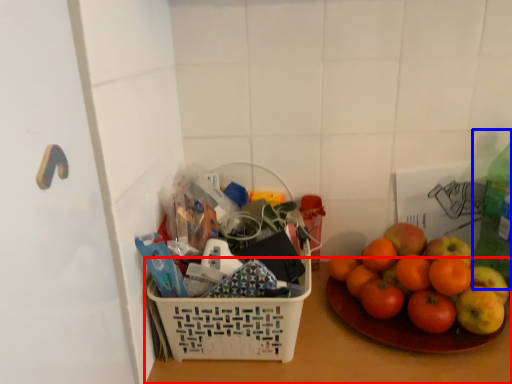
Question: Which point is closer to the camera, table top (highlighted by a red box) or bottle (highlighted by a blue box)?

Choices:
 (A) table top
 (B) bottle

Answer: (A)